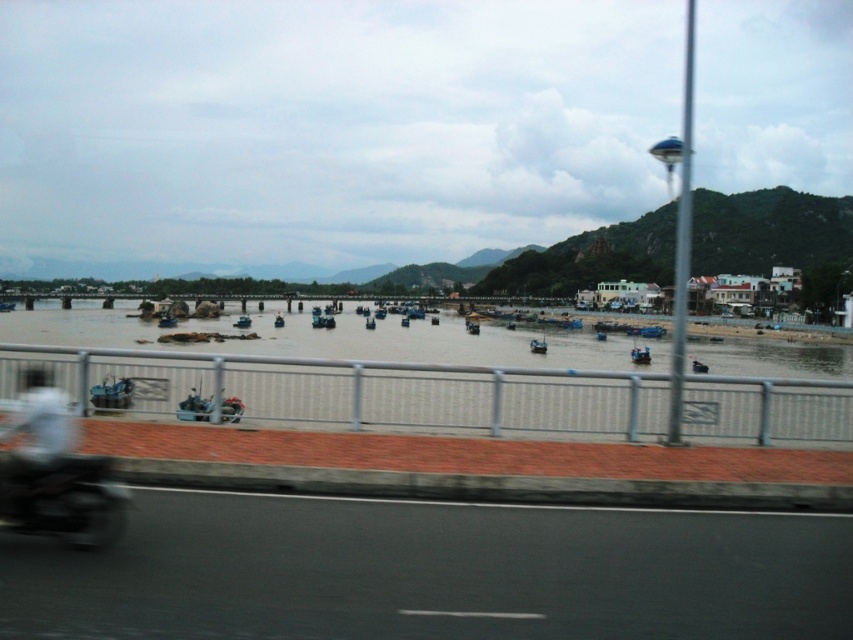
You are riding a motorbike on the road and want to stay on the black asphalt road at lower center. What coordinates should you aim for to stay on the road?

You should aim for the coordinates point at [433,572] to stay on the black asphalt road at lower center.

You are driving a car and want to avoid hitting the metallic gray fence at lower center. According to the scene, where should you steer your car to stay on the black asphalt road at lower center?

The black asphalt road at lower center is positioned under the metallic gray fence at lower center, so steering the car under the fence would keep you on the road.

You are a photographer trying to capture the coastal scene from the motorbike. Which object, the black asphalt road at lower center or the white matte helmet at upper left, would occupy more space in your photo?

The black asphalt road at lower center occupies more space in the photo because it is bigger than the white matte helmet at upper left.